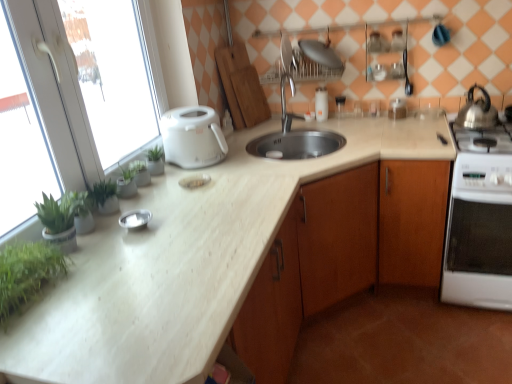
Identify the location of vacant area that lies between silver metallic bowl at center, which ranks as the fourth appliance in back-to-front order, and clear glass jar at upper right, which is the first appliance in right-to-left order. The height and width of the screenshot is (384, 512). (278, 161).